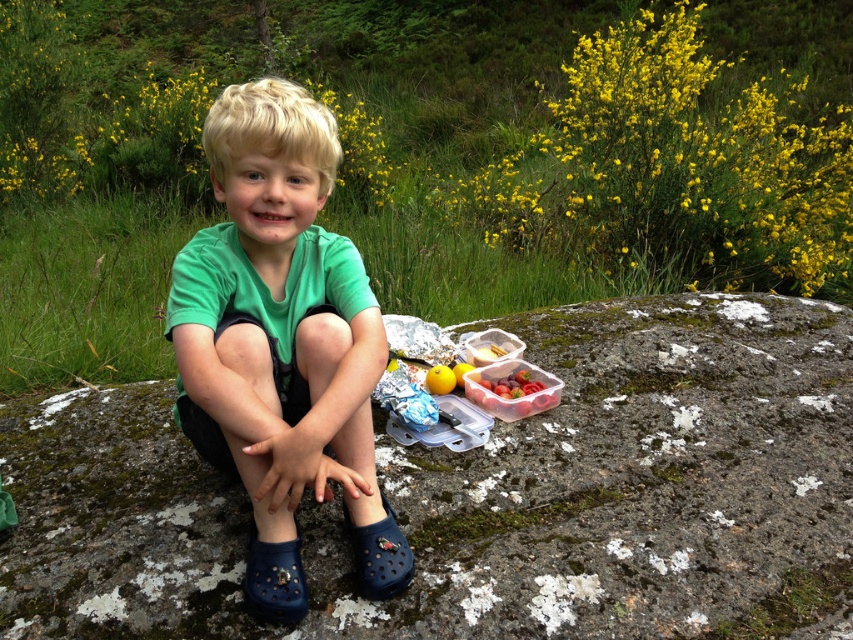
Is point (257, 605) less distant than point (436, 376)?

Yes, point (257, 605) is in front of point (436, 376).

Is point (271, 582) closer to viewer compared to point (450, 371)?

Yes, point (271, 582) is closer to viewer.

The height and width of the screenshot is (640, 853). I want to click on blue rubber shoe at lower left, so click(274, 579).

Can you confirm if gray mossy rock at center is smaller than yellow matte apple at center?

Actually, gray mossy rock at center might be larger than yellow matte apple at center.

Does gray mossy rock at center have a larger size compared to yellow matte apple at center?

Yes, gray mossy rock at center is bigger than yellow matte apple at center.

Is point (848, 636) closer to camera compared to point (448, 372)?

Yes, point (848, 636) is in front of point (448, 372).

Where is `gray mossy rock at center`? The width and height of the screenshot is (853, 640). gray mossy rock at center is located at coordinates (486, 497).

Does point (801, 332) lie in front of point (273, 614)?

No, it is not.

At what (x,y) coordinates should I click in order to perform the action: click on gray mossy rock at center. Please return your answer as a coordinate pair (x, y). The width and height of the screenshot is (853, 640). Looking at the image, I should click on (486, 497).

In order to click on gray mossy rock at center in this screenshot , I will do `click(486, 497)`.